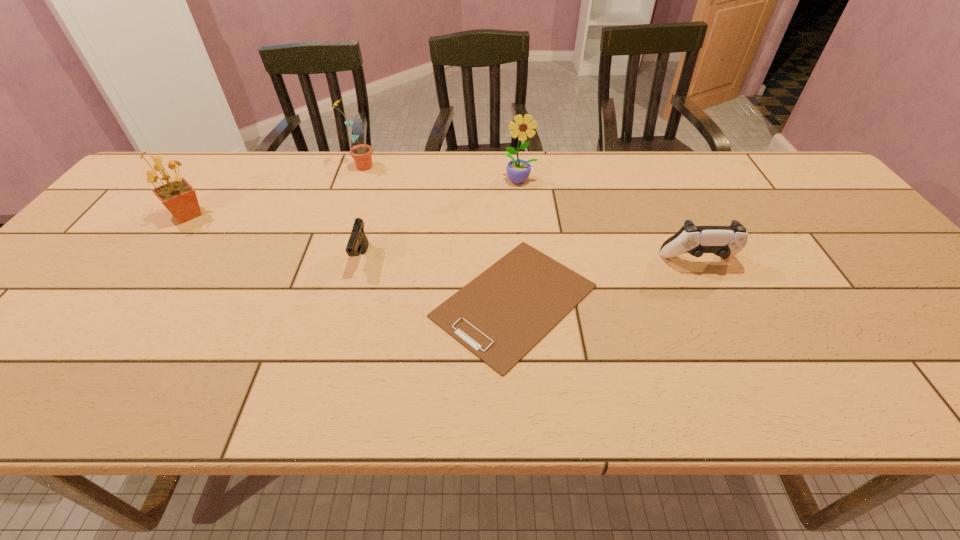
Locate an element on the screen. The height and width of the screenshot is (540, 960). the rightmost sunflower is located at coordinates (518, 170).

Identify the location of the fifth object from right to left. The image size is (960, 540). (362, 154).

Identify the location of the leftmost sunflower. The image size is (960, 540). (179, 197).

Identify the location of the nearest sunflower. (179, 197).

This screenshot has width=960, height=540. Find the location of `control`. control is located at coordinates coord(724,241).

What are the coordinates of `the rightmost object` in the screenshot? It's located at (724, 241).

This screenshot has height=540, width=960. In order to click on pistol in this screenshot , I will do `click(358, 243)`.

Find the location of a particular element. the fourth object from right to left is located at coordinates (358, 243).

What are the coordinates of `the shortest object` in the screenshot? It's located at (499, 316).

Find the location of a particular element. The height and width of the screenshot is (540, 960). free space located on the front-facing side of the rightmost sunflower is located at coordinates (525, 222).